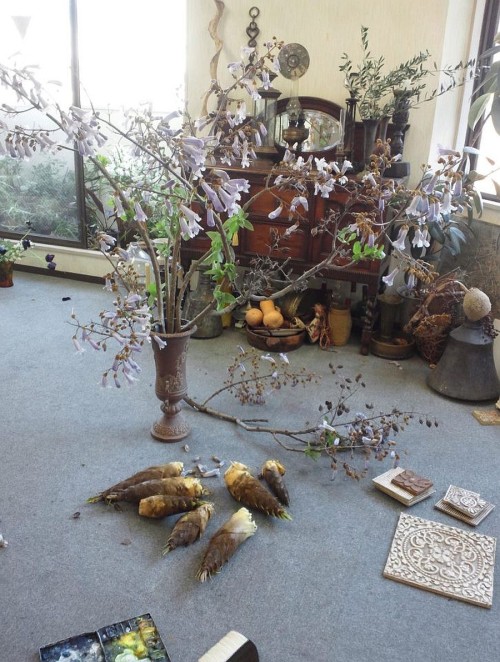
Locate an element on the screen. The image size is (500, 662). large branch on floor next to large vase is located at coordinates (212, 410).